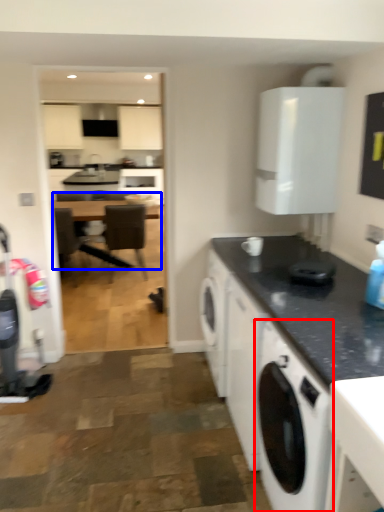
Question: Which of the following is the closest to the observer, washing machine (highlighted by a red box) or table (highlighted by a blue box)?

Choices:
 (A) washing machine
 (B) table

Answer: (A)